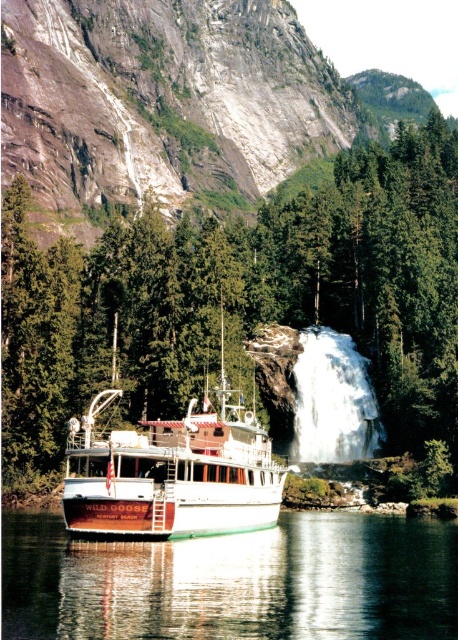
Can you confirm if green reflective water at lower center is positioned to the right of white frothy water at center?

In fact, green reflective water at lower center is to the left of white frothy water at center.

You are a GUI agent. You are given a task and a screenshot of the screen. Output one action in this format:
    pyautogui.click(x=<x>, y=<y>)
    Task: Click on the green reflective water at lower center
    Image resolution: width=458 pixels, height=640 pixels.
    Given the screenshot: What is the action you would take?
    pyautogui.click(x=234, y=580)

Can you confirm if green textured tree at center is smaller than white frothy water at center?

Incorrect, green textured tree at center is not smaller in size than white frothy water at center.

Is point (39, 310) positioned before point (303, 356)?

That is True.

Locate an element on the screen. This screenshot has width=458, height=640. green textured tree at center is located at coordinates (241, 300).

Is green textured tree at center shorter than green reflective water at lower center?

Incorrect, green textured tree at center's height does not fall short of green reflective water at lower center's.

Who is taller, green textured tree at center or green reflective water at lower center?

Standing taller between the two is green textured tree at center.

Between point (441, 376) and point (451, 593), which one is positioned in front?

Point (451, 593) is more forward.

The height and width of the screenshot is (640, 458). Find the location of `green textured tree at center`. green textured tree at center is located at coordinates (241, 300).